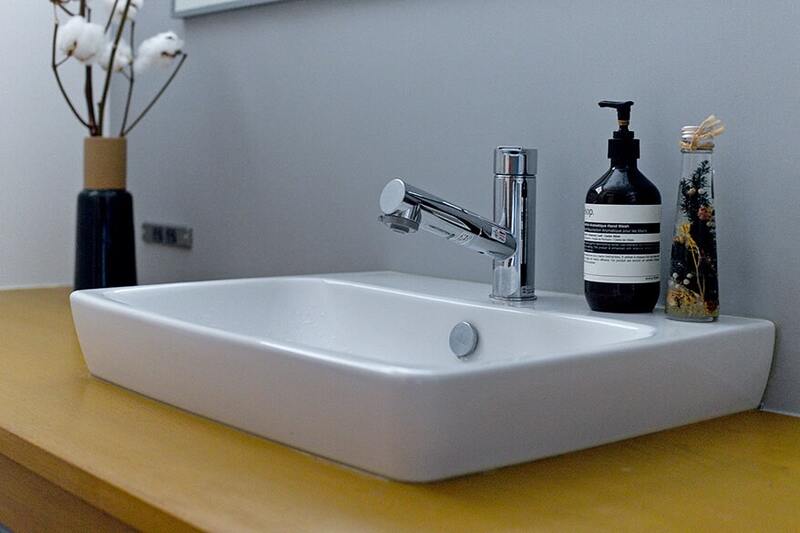
This screenshot has height=533, width=800. What are the coordinates of `tap` in the screenshot? It's located at (517, 192).